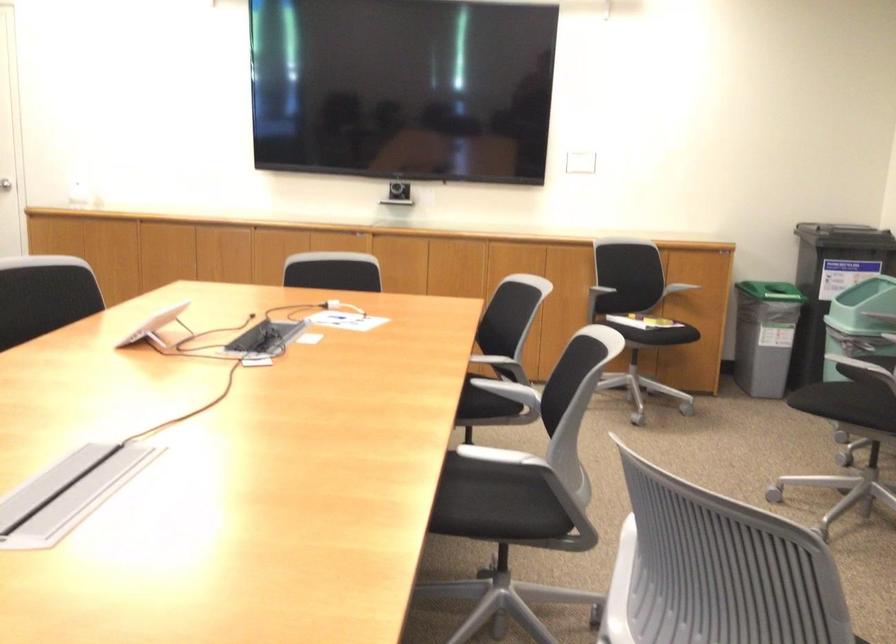
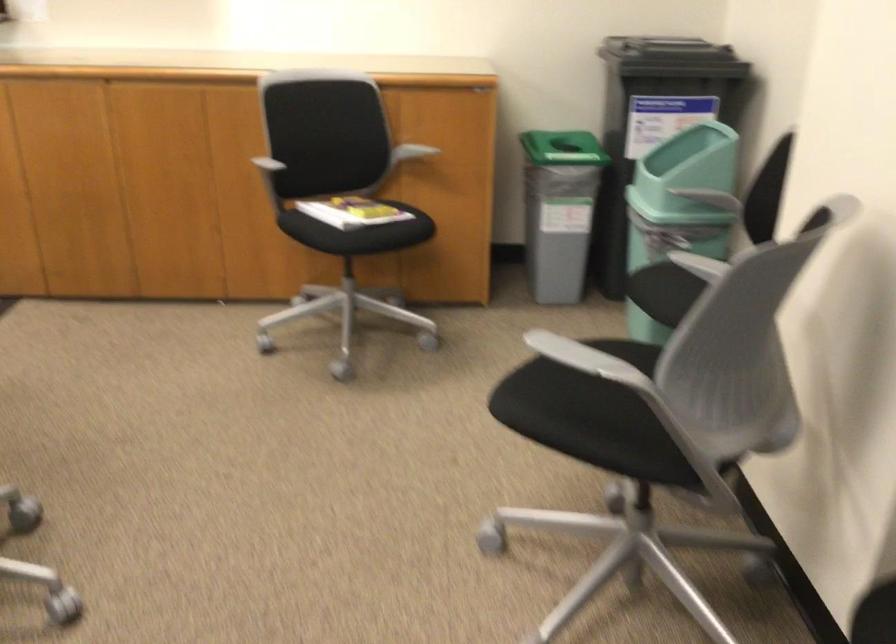
The point at (675, 267) is marked in the first image. Where is the corresponding point in the second image?

(409, 152)